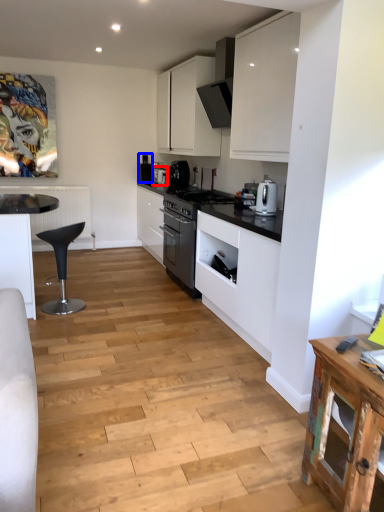
Question: Which object appears farthest to the camera in this image, kitchen appliance (highlighted by a red box) or appliance (highlighted by a blue box)?

Choices:
 (A) kitchen appliance
 (B) appliance

Answer: (B)